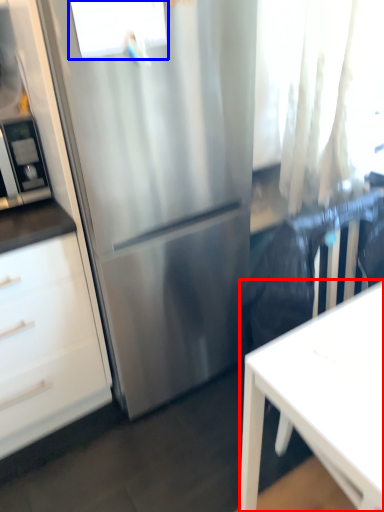
Question: Which point is further to the camera, desk (highlighted by a red box) or window (highlighted by a blue box)?

Choices:
 (A) desk
 (B) window

Answer: (B)